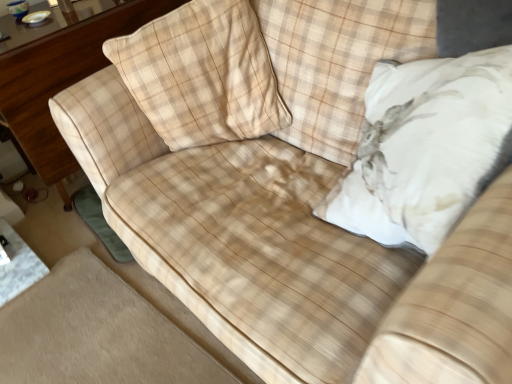
Question: Does beige plaid pillow at upper left, the first throw pillow in the left-to-right sequence, turn towards white plush pillow at upper right, marked as the 1th throw pillow in a right-to-left arrangement?

Choices:
 (A) no
 (B) yes

Answer: (A)

Question: Can you confirm if beige plaid pillow at upper left, marked as the 2th throw pillow in a right-to-left arrangement, is bigger than white plush pillow at upper right, which is the second throw pillow in left-to-right order?

Choices:
 (A) yes
 (B) no

Answer: (B)

Question: Are beige plaid pillow at upper left, the first throw pillow in the left-to-right sequence, and white plush pillow at upper right, marked as the 1th throw pillow in a right-to-left arrangement, located far from each other?

Choices:
 (A) yes
 (B) no

Answer: (B)

Question: From a real-world perspective, is beige plaid pillow at upper left, the first throw pillow in the left-to-right sequence, positioned over white plush pillow at upper right, which is the second throw pillow in left-to-right order, based on gravity?

Choices:
 (A) no
 (B) yes

Answer: (B)

Question: Does beige plaid pillow at upper left, the first throw pillow in the left-to-right sequence, come in front of white plush pillow at upper right, which is the second throw pillow in left-to-right order?

Choices:
 (A) yes
 (B) no

Answer: (B)

Question: From the image's perspective, is white plush pillow at upper right, marked as the 1th throw pillow in a right-to-left arrangement, above or below wooden dresser at left?

Choices:
 (A) below
 (B) above

Answer: (A)

Question: Is white plush pillow at upper right, marked as the 1th throw pillow in a right-to-left arrangement, situated inside wooden dresser at left or outside?

Choices:
 (A) outside
 (B) inside

Answer: (A)

Question: Relative to wooden dresser at left, is white plush pillow at upper right, marked as the 1th throw pillow in a right-to-left arrangement, in front or behind?

Choices:
 (A) behind
 (B) front

Answer: (B)

Question: From their relative heights in the image, would you say white plush pillow at upper right, which is the second throw pillow in left-to-right order, is taller or shorter than wooden dresser at left?

Choices:
 (A) tall
 (B) short

Answer: (B)

Question: From a real-world perspective, is white plush pillow at upper right, marked as the 1th throw pillow in a right-to-left arrangement, positioned above or below beige plaid pillow at upper left, marked as the 2th throw pillow in a right-to-left arrangement?

Choices:
 (A) below
 (B) above

Answer: (A)

Question: Considering the positions of point (420, 150) and point (177, 120), is point (420, 150) closer or farther from the camera than point (177, 120)?

Choices:
 (A) farther
 (B) closer

Answer: (B)

Question: Is white plush pillow at upper right, which is the second throw pillow in left-to-right order, wider or thinner than beige plaid pillow at upper left, marked as the 2th throw pillow in a right-to-left arrangement?

Choices:
 (A) wide
 (B) thin

Answer: (A)

Question: Considering their positions, is white plush pillow at upper right, marked as the 1th throw pillow in a right-to-left arrangement, located in front of or behind beige plaid pillow at upper left, marked as the 2th throw pillow in a right-to-left arrangement?

Choices:
 (A) behind
 (B) front

Answer: (B)

Question: Based on their positions, is beige plaid pillow at upper left, marked as the 2th throw pillow in a right-to-left arrangement, located to the left or right of wooden dresser at left?

Choices:
 (A) right
 (B) left

Answer: (A)

Question: Is beige plaid pillow at upper left, the first throw pillow in the left-to-right sequence, bigger or smaller than wooden dresser at left?

Choices:
 (A) small
 (B) big

Answer: (A)